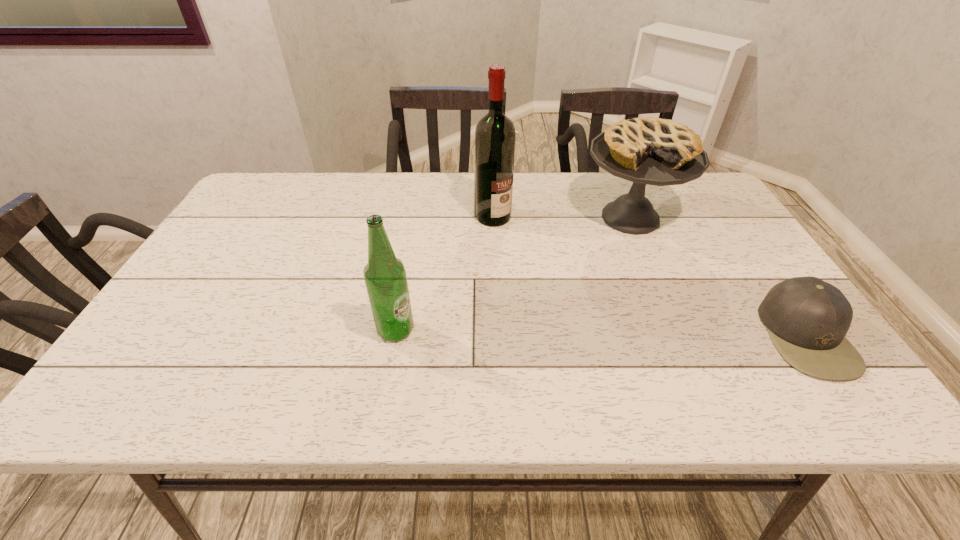
Image resolution: width=960 pixels, height=540 pixels. Find the location of `the leftmost object`. the leftmost object is located at coordinates (385, 277).

Where is `the rightmost object`? the rightmost object is located at coordinates pyautogui.click(x=807, y=318).

You are a GUI agent. You are given a task and a screenshot of the screen. Output one action in this format:
    pyautogui.click(x=<x>, y=<y>)
    Task: Click on the cap
    
    Given the screenshot: What is the action you would take?
    pyautogui.click(x=807, y=318)

Find the location of `the second object from right to left`. the second object from right to left is located at coordinates (653, 151).

I want to click on the tallest object, so pos(495,135).

Where is `alcohol`? The height and width of the screenshot is (540, 960). alcohol is located at coordinates (495, 135).

Locate an element on the screen. This screenshot has width=960, height=540. vacant area situated on the label of the leftmost object is located at coordinates (509, 330).

This screenshot has height=540, width=960. Find the location of `vacant space situated on the brim of the rightmost object`. vacant space situated on the brim of the rightmost object is located at coordinates (631, 335).

What are the coordinates of `vacant area situated 0.310m on the brim of the rightmost object` in the screenshot? It's located at [626, 335].

Where is `vacant space located on the brim of the rightmost object`? The width and height of the screenshot is (960, 540). vacant space located on the brim of the rightmost object is located at coordinates (745, 335).